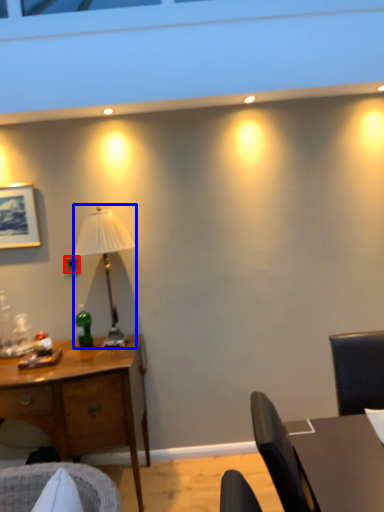
Question: Which object is closer to the camera taking this photo, power outlet (highlighted by a red box) or lamp (highlighted by a blue box)?

Choices:
 (A) power outlet
 (B) lamp

Answer: (B)